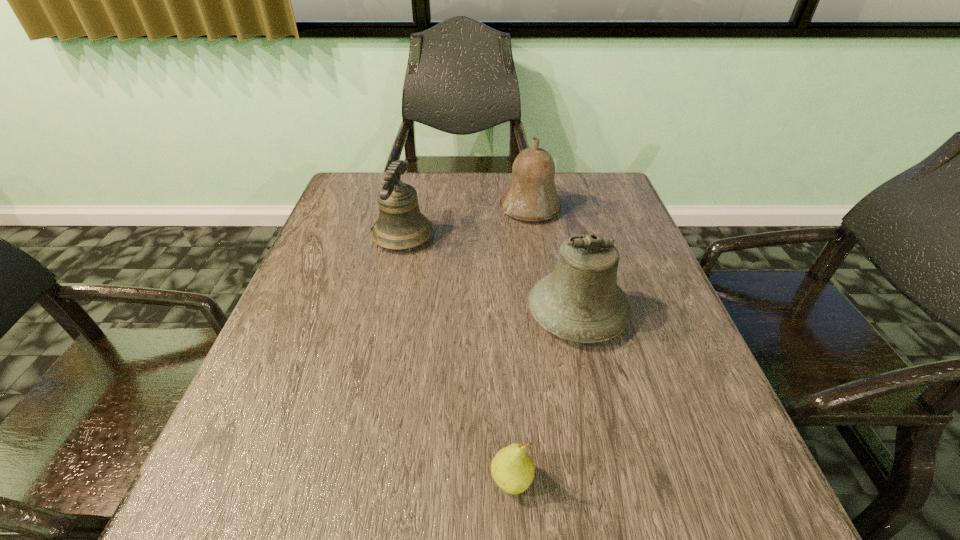
Find the location of `object that is at the right edge`. object that is at the right edge is located at coordinates (580, 301).

Locate an element on the screen. The height and width of the screenshot is (540, 960). vacant region at the far edge of the desktop is located at coordinates (477, 184).

Image resolution: width=960 pixels, height=540 pixels. I want to click on vacant space at the near edge of the desktop, so click(475, 483).

Find the location of a particular element. vacant area at the left edge of the desktop is located at coordinates (247, 471).

The height and width of the screenshot is (540, 960). In order to click on free space at the right edge of the desktop in this screenshot , I will do `click(613, 219)`.

In order to click on vacant space at the far left corner of the desktop in this screenshot , I will do `click(348, 208)`.

Find the location of a particular element. free location at the near left corner is located at coordinates (223, 511).

What are the coordinates of `free space at the far right corner of the desktop` in the screenshot? It's located at (610, 213).

Image resolution: width=960 pixels, height=540 pixels. What are the coordinates of `free space between the shortest object and the third farthest object` in the screenshot? It's located at (544, 397).

Locate an element on the screen. The image size is (960, 540). vacant space in between the leftmost object and the shortest object is located at coordinates (457, 359).